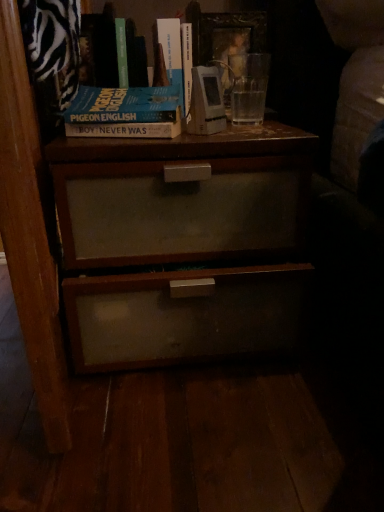
Question: Is hardcover book at upper center, the second book when ordered from right to left, at the left side of hardcover book at upper center, the 2th book viewed from the left?

Choices:
 (A) yes
 (B) no

Answer: (A)

Question: Is hardcover book at upper center, arranged as the 1th book when viewed from the left, placed right next to hardcover book at upper center, marked as the first book in a right-to-left arrangement?

Choices:
 (A) no
 (B) yes

Answer: (B)

Question: Would you say hardcover book at upper center, the second book when ordered from right to left, contains hardcover book at upper center, the 2th book viewed from the left?

Choices:
 (A) no
 (B) yes

Answer: (A)

Question: Does hardcover book at upper center, arranged as the 1th book when viewed from the left, lie in front of hardcover book at upper center, the 2th book viewed from the left?

Choices:
 (A) no
 (B) yes

Answer: (B)

Question: Considering the relative sizes of hardcover book at upper center, arranged as the 1th book when viewed from the left, and hardcover book at upper center, marked as the first book in a right-to-left arrangement, in the image provided, is hardcover book at upper center, arranged as the 1th book when viewed from the left, shorter than hardcover book at upper center, marked as the first book in a right-to-left arrangement,?

Choices:
 (A) no
 (B) yes

Answer: (A)

Question: Is hardcover book at upper center, the second book when ordered from right to left, looking in the opposite direction of hardcover book at upper center, marked as the first book in a right-to-left arrangement?

Choices:
 (A) yes
 (B) no

Answer: (B)

Question: Is hardcover book at upper center, marked as the first book in a right-to-left arrangement, shorter than matte wood nightstand at center?

Choices:
 (A) yes
 (B) no

Answer: (A)

Question: Is hardcover book at upper center, the 2th book viewed from the left, aimed at matte wood nightstand at center?

Choices:
 (A) yes
 (B) no

Answer: (B)

Question: From the image's perspective, is hardcover book at upper center, marked as the first book in a right-to-left arrangement, on top of matte wood nightstand at center?

Choices:
 (A) no
 (B) yes

Answer: (B)

Question: Is hardcover book at upper center, the 2th book viewed from the left, positioned beyond the bounds of matte wood nightstand at center?

Choices:
 (A) no
 (B) yes

Answer: (B)

Question: Can you confirm if hardcover book at upper center, the 2th book viewed from the left, is bigger than matte wood nightstand at center?

Choices:
 (A) no
 (B) yes

Answer: (A)

Question: Is hardcover book at upper center, marked as the first book in a right-to-left arrangement, oriented away from matte wood nightstand at center?

Choices:
 (A) no
 (B) yes

Answer: (A)

Question: From the image's perspective, does hardcover book at upper center, the second book when ordered from right to left, appear higher than blue matte book at upper center?

Choices:
 (A) yes
 (B) no

Answer: (A)